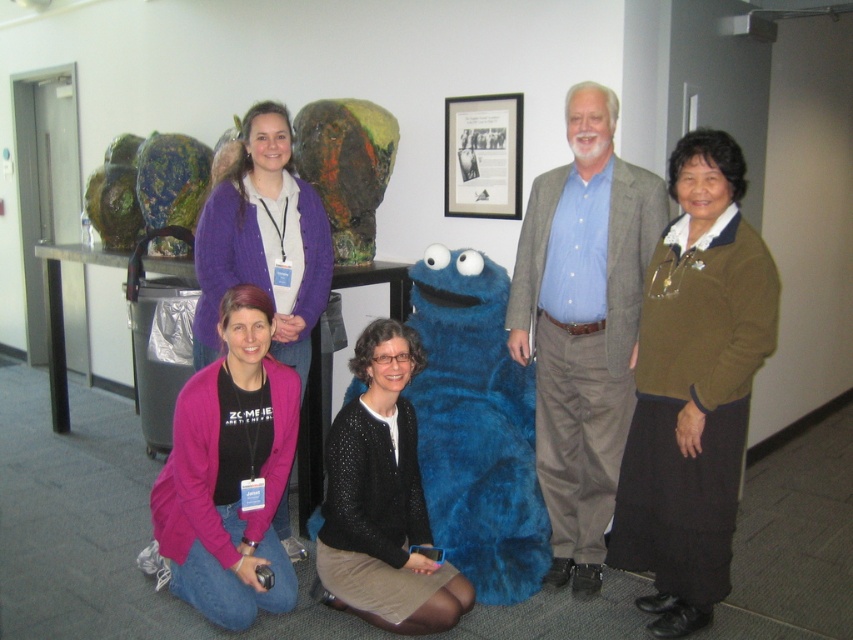
You are standing in the office and need to find the pink fleece jacket at lower left and the black knitted sweater at center. Based on their positions, which object is closer to the left side of the scene?

The pink fleece jacket at lower left is closer to the left side of the scene since it is positioned to the left of the black knitted sweater at center.

You are standing in the office scene and need to hand a document to both the person wearing the green sweater at right and the person wearing the black knitted sweater at center. Which person should you approach first to ensure you visit them in the correct spatial order based on their positions?

You should approach the person wearing the black knitted sweater at center first because the green sweater at right is positioned to the right of the black knitted sweater at center, meaning the black knitted sweater at center is closer to your starting position in the middle of the scene.

You are standing in the office where the photo was taken and need to locate the green sweater at right. According to the coordinates provided, where should you look to find it?

The green sweater at right is located at point 0.608 on the horizontal axis and 0.814 on the vertical axis.